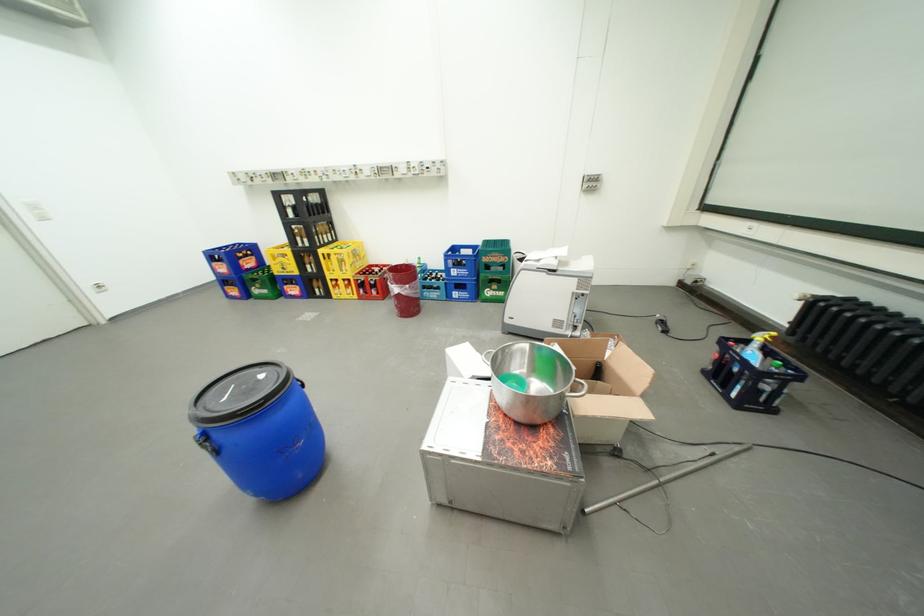
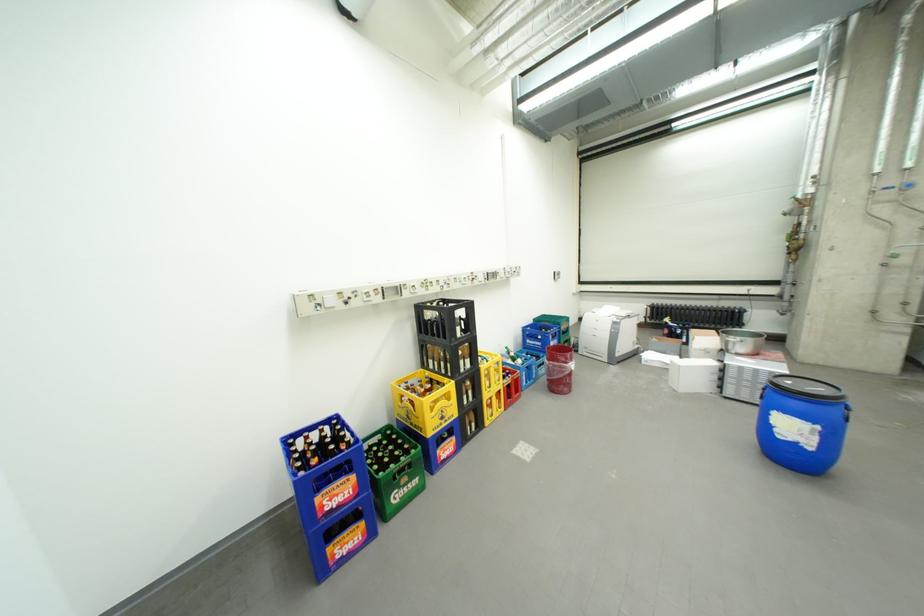
Find the pixel in the second image that matches point 277,267 in the first image.

(387, 443)